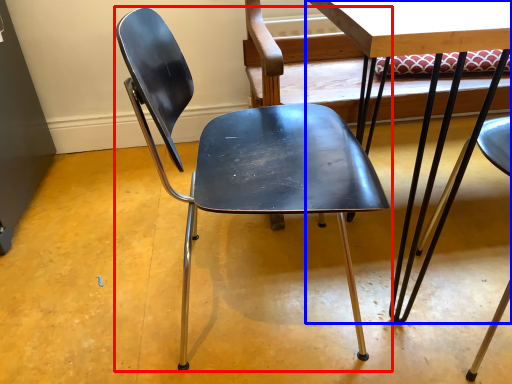
Question: Which object is further to the camera taking this photo, chair (highlighted by a red box) or table (highlighted by a blue box)?

Choices:
 (A) chair
 (B) table

Answer: (A)